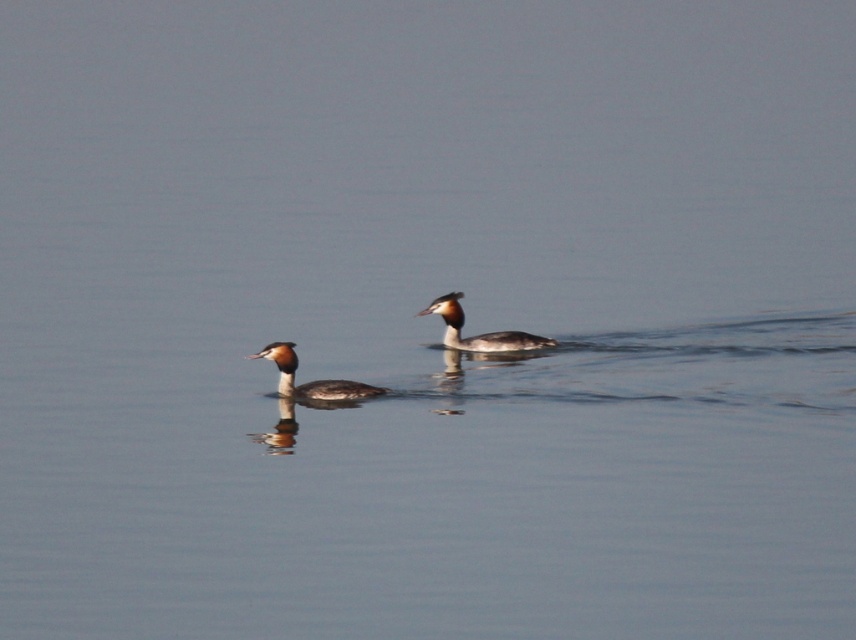
Is brown speckled duck at center to the right of brown glossy duck at center from the viewer's perspective?

In fact, brown speckled duck at center is to the left of brown glossy duck at center.

Who is more distant from viewer, (348, 388) or (450, 342)?

Point (450, 342)

This screenshot has width=856, height=640. What do you see at coordinates (311, 380) in the screenshot?
I see `brown speckled duck at center` at bounding box center [311, 380].

Locate an element on the screen. Image resolution: width=856 pixels, height=640 pixels. brown speckled duck at center is located at coordinates (311, 380).